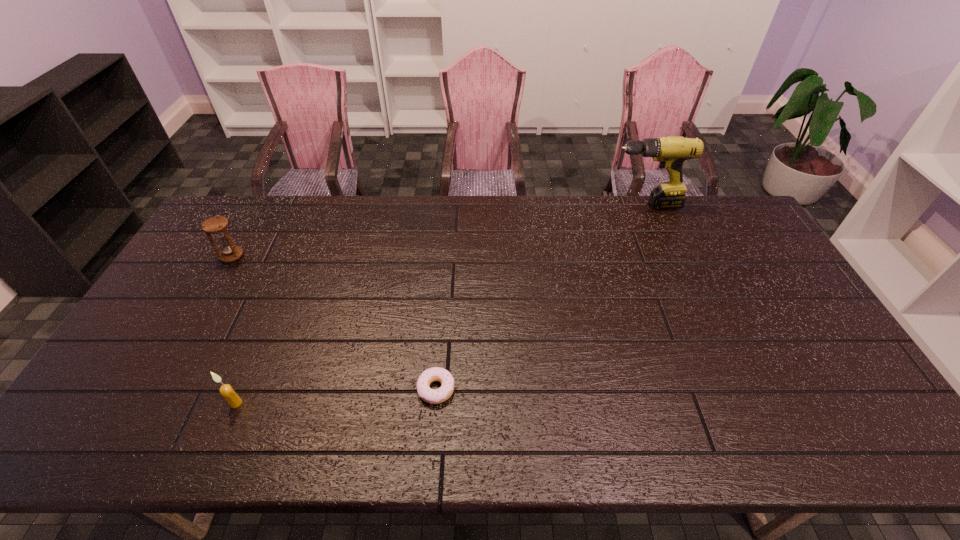
Locate which object ranks second in proximity to the candle. Please provide its 2D coordinates. Your answer should be formatted as a tuple, i.e. [(x, y)], where the tuple contains the x and y coordinates of a point satisfying the conditions above.

[(217, 226)]

Identify the location of vacant area in the image that satisfies the following two spatial constraints: 1. on the front side of the third nearest object; 2. on the left side of the doughnut. The image size is (960, 540). (156, 389).